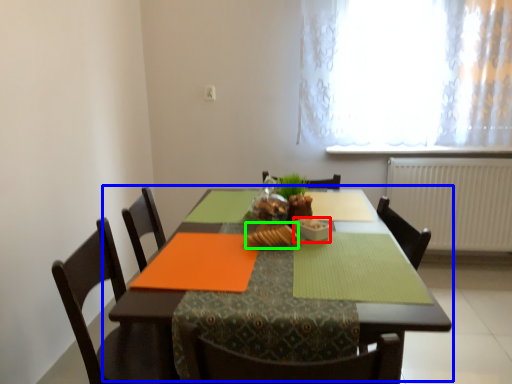
Question: Estimate the real-world distances between objects in this image. Which object is farther from tableware (highlighted by a red box), table (highlighted by a blue box) or food (highlighted by a green box)?

Choices:
 (A) table
 (B) food

Answer: (A)